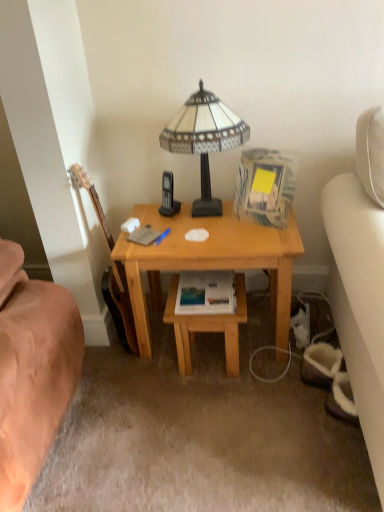
What do you see at coordinates (207, 327) in the screenshot? The width and height of the screenshot is (384, 512). I see `light brown wood table at center` at bounding box center [207, 327].

Locate an element on the screen. This screenshot has width=384, height=512. wooden acoustic guitar at left is located at coordinates (121, 303).

Image resolution: width=384 pixels, height=512 pixels. Find the location of `wooden desk at center`. wooden desk at center is located at coordinates (208, 259).

Where is `light brown wood table at center`? This screenshot has height=512, width=384. light brown wood table at center is located at coordinates (207, 327).

Considering the sizes of stained glass lampshade at center and wooden desk at center in the image, is stained glass lampshade at center wider or thinner than wooden desk at center?

stained glass lampshade at center is thinner than wooden desk at center.

Can you confirm if stained glass lampshade at center is smaller than wooden desk at center?

Yes.

From the image's perspective, which one is positioned lower, stained glass lampshade at center or wooden desk at center?

wooden desk at center is shown below in the image.

Considering the relative sizes of stained glass lampshade at center and wooden desk at center in the image provided, is stained glass lampshade at center shorter than wooden desk at center?

Yes.

From a real-world perspective, does matte paper paperback book at center sit lower than stained glass lampshade at center?

Yes, from a real-world perspective, matte paper paperback book at center is under stained glass lampshade at center.

From the image's perspective, which is above, matte paper paperback book at center or stained glass lampshade at center?

stained glass lampshade at center appears higher in the image.

Can we say matte paper paperback book at center lies outside stained glass lampshade at center?

Absolutely, matte paper paperback book at center is external to stained glass lampshade at center.

The height and width of the screenshot is (512, 384). Identify the location of lamp above the matte paper paperback book at center (from a real-world perspective). (204, 139).

Which point is more distant from viewer, (201,124) or (237,289)?

The point (237,289) is behind.

Is stained glass lampshade at center located outside light brown wood table at center?

Indeed, stained glass lampshade at center is completely outside light brown wood table at center.

This screenshot has width=384, height=512. Identify the location of lamp to the left of light brown wood table at center. (204, 139).

Would you say matte paper paperback book at center is a long distance from light brown wood table at center?

That's not correct — matte paper paperback book at center is a little close to light brown wood table at center.

Considering the sizes of objects matte paper paperback book at center and light brown wood table at center in the image provided, who is thinner, matte paper paperback book at center or light brown wood table at center?

Thinner between the two is matte paper paperback book at center.

From the picture: Could you tell me if matte paper paperback book at center is turned towards light brown wood table at center?

No, matte paper paperback book at center is not aimed at light brown wood table at center.

Identify the location of table that is on the right side of wooden acoustic guitar at left. The image size is (384, 512). (207, 327).

From the image's perspective, who appears lower, wooden acoustic guitar at left or light brown wood table at center?

light brown wood table at center.

Can you confirm if wooden acoustic guitar at left is wider than light brown wood table at center?

Incorrect, the width of wooden acoustic guitar at left does not surpass that of light brown wood table at center.

In the scene shown: Which object is positioned more to the left, stained glass lampshade at center or matte paper paperback book at center?

Positioned to the left is stained glass lampshade at center.

Between stained glass lampshade at center and matte paper paperback book at center, which one has larger width?

With larger width is stained glass lampshade at center.

Between point (219, 206) and point (191, 279), which one is positioned in front?

The point (191, 279) is closer.

From a real-world perspective, is wooden acoustic guitar at left below stained glass lampshade at center?

Yes, from a real-world perspective, wooden acoustic guitar at left is under stained glass lampshade at center.

From the image's perspective, is wooden acoustic guitar at left over stained glass lampshade at center?

Actually, wooden acoustic guitar at left appears below stained glass lampshade at center in the image.

Is wooden acoustic guitar at left far from stained glass lampshade at center?

That's not correct — wooden acoustic guitar at left is a little close to stained glass lampshade at center.

Find the location of `lamp above the wooden desk at center (from the image's perspective)`. lamp above the wooden desk at center (from the image's perspective) is located at coordinates (204, 139).

Image resolution: width=384 pixels, height=512 pixels. What are the coordinates of `paperback book below the stained glass lampshade at center (from a real-world perspective)` in the screenshot? It's located at (206, 293).

Looking at the image, which one is located further to matte paper paperback book at center, wooden desk at center or stained glass lampshade at center?

The object further to matte paper paperback book at center is stained glass lampshade at center.

Which object lies nearer to the anchor point light brown wood table at center, wooden acoustic guitar at left or matte paper paperback book at center?

Among the two, matte paper paperback book at center is located nearer to light brown wood table at center.

Looking at the image, which one is located closer to matte paper paperback book at center, wooden acoustic guitar at left or stained glass lampshade at center?

wooden acoustic guitar at left is closer to matte paper paperback book at center.

Which object lies further to the anchor point wooden acoustic guitar at left, stained glass lampshade at center or light brown wood table at center?

stained glass lampshade at center.

Estimate the real-world distances between objects in this image. Which object is closer to wooden acoustic guitar at left, light brown wood table at center or stained glass lampshade at center?

light brown wood table at center.

When comparing their distances from wooden acoustic guitar at left, does stained glass lampshade at center or matte paper paperback book at center seem further?

stained glass lampshade at center lies further to wooden acoustic guitar at left than the other object.

Looking at the image, which one is located further to wooden acoustic guitar at left, light brown wood table at center or matte paper paperback book at center?

matte paper paperback book at center lies further to wooden acoustic guitar at left than the other object.

From the image, which object appears to be farther from stained glass lampshade at center, light brown wood table at center or wooden acoustic guitar at left?

light brown wood table at center is positioned further to the anchor stained glass lampshade at center.

You are a GUI agent. You are given a task and a screenshot of the screen. Output one action in this format:
    pyautogui.click(x=<x>, y=<y>)
    Task: Click on the paperback book situated between wooden acoustic guitar at left and light brown wood table at center from left to right
    Image resolution: width=384 pixels, height=512 pixels.
    Given the screenshot: What is the action you would take?
    (x=206, y=293)

Locate an element on the screen. Image resolution: width=384 pixels, height=512 pixels. guitar between stained glass lampshade at center and matte paper paperback book at center from top to bottom is located at coordinates (121, 303).

Where is `desk between stained glass lampshade at center and matte paper paperback book at center in the vertical direction`? The width and height of the screenshot is (384, 512). desk between stained glass lampshade at center and matte paper paperback book at center in the vertical direction is located at coordinates (208, 259).

At what (x,y) coordinates should I click in order to perform the action: click on guitar between stained glass lampshade at center and wooden desk at center in the vertical direction. Please return your answer as a coordinate pair (x, y). This screenshot has width=384, height=512. Looking at the image, I should click on (121, 303).